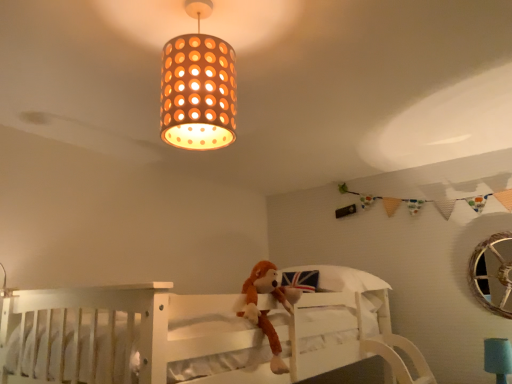
I want to click on free point above orange perforated paper lampshade at upper center (from a real-world perspective), so click(196, 8).